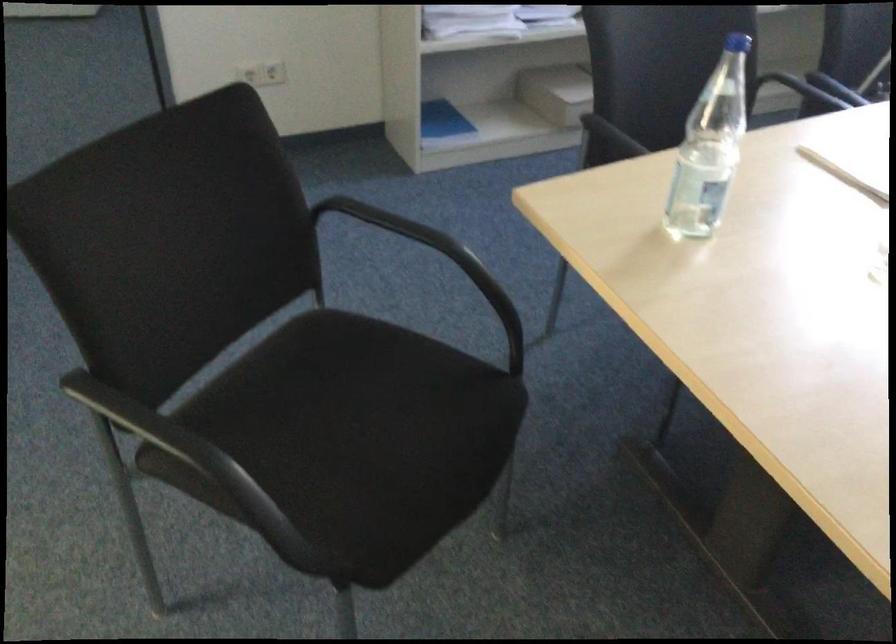
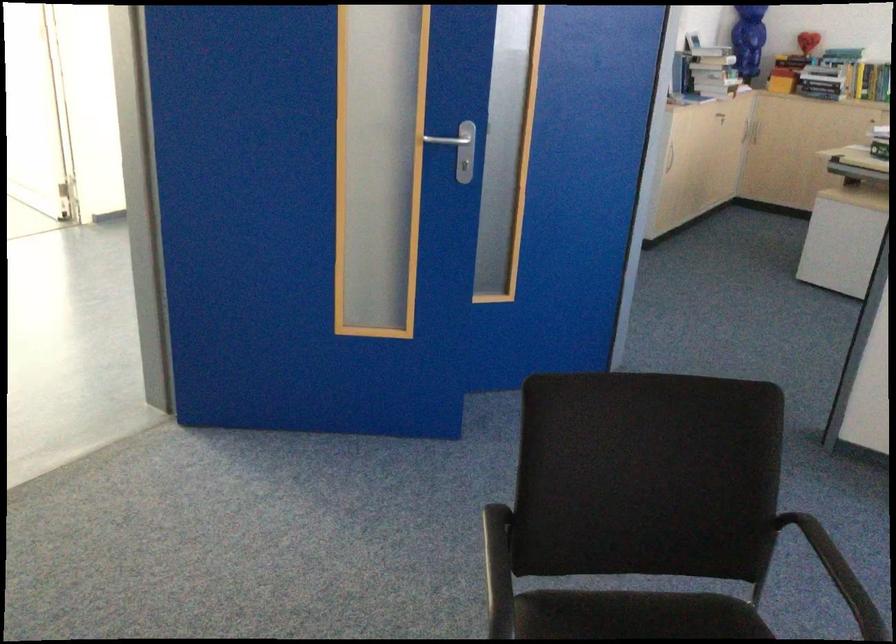
Question: How did the camera likely rotate?

Choices:
 (A) Left
 (B) Right
 (C) Up
 (D) Down

Answer: (A)